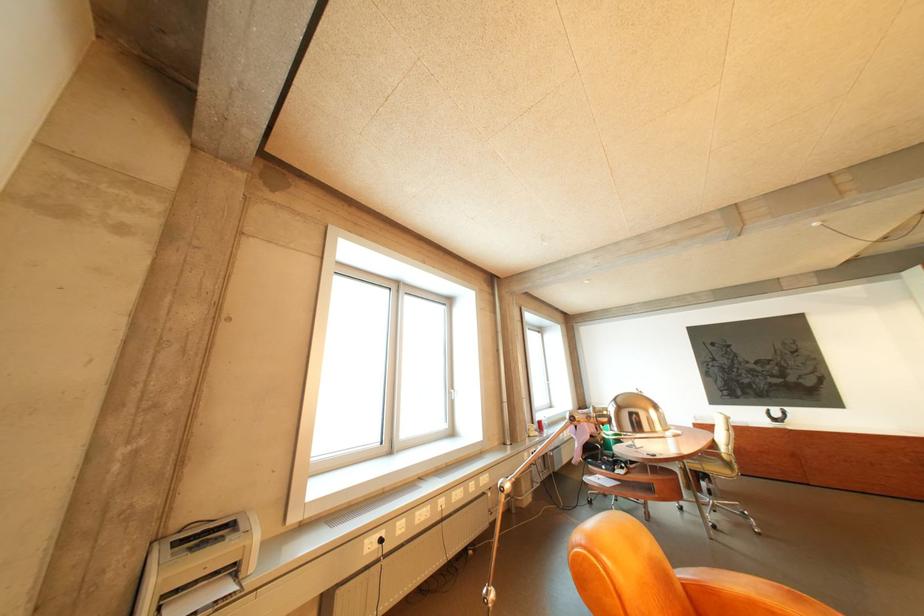
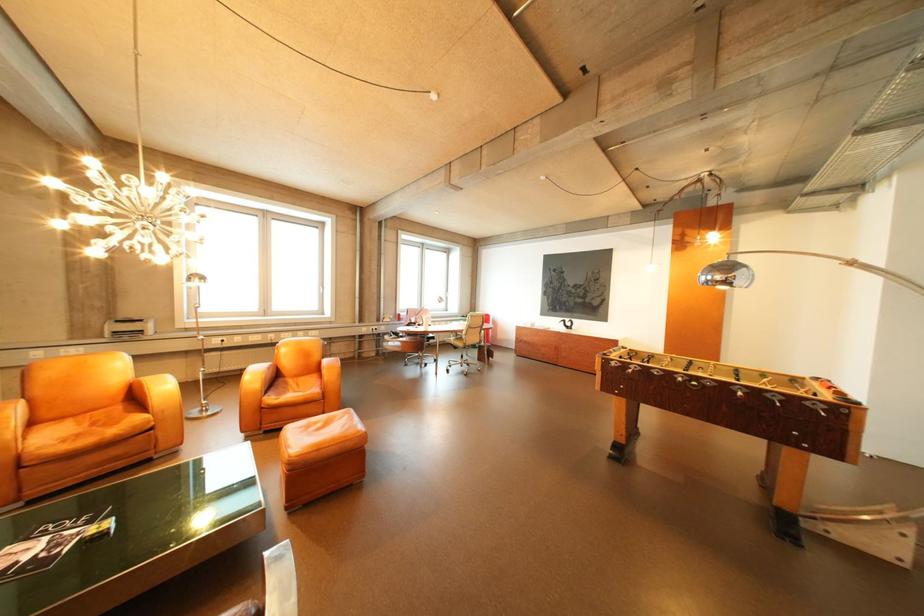
What movement of the cameraman would produce the second image?

The cameraman walked toward right, backward.